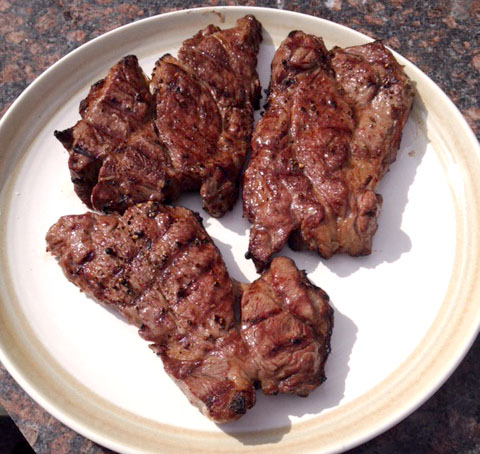
Locate an element on the screen. The height and width of the screenshot is (454, 480). plate is located at coordinates (409, 309).